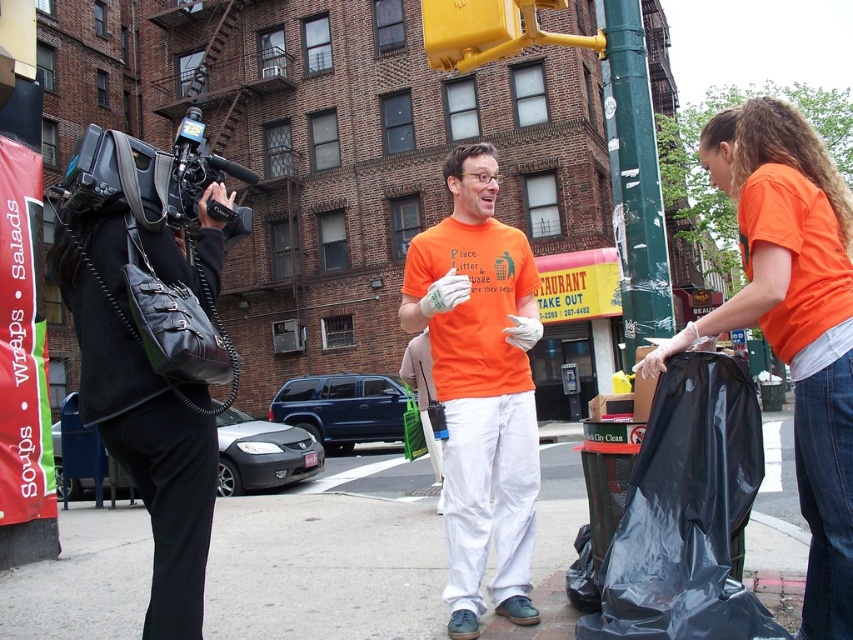
You are a photographer standing in the street scene. You need to take a photo of both the orange cotton shirt at center and the black plastic bag at lower right. Which object should you focus on first if you want to capture both in the same frame without moving your camera?

The orange cotton shirt at center is taller than the black plastic bag at lower right, so you should focus on the orange cotton shirt at center first to ensure both fit in the frame.

Please describe the spatial relationship between the orange fabric shirt at center and the point labeled as point (793,317) in the image.

The orange fabric shirt at center is represented by point (793,317) in the image.

You are a pedestrian walking down the street and see the orange fabric shirt at center and the black plastic video camera at left. Which object is positioned more to the left side of the scene?

The black plastic video camera at left is positioned more to the left side of the scene than the orange fabric shirt at center.